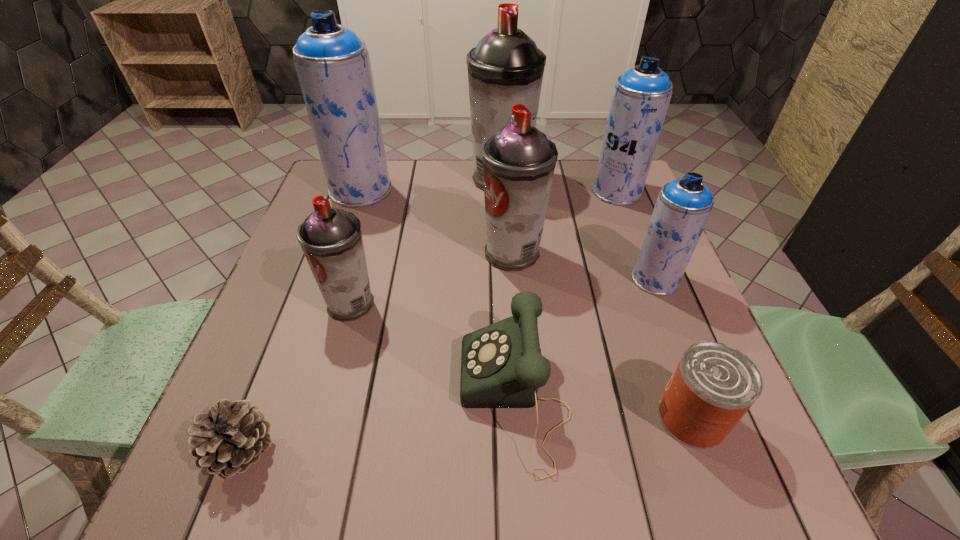
This screenshot has height=540, width=960. In order to click on the farthest gray aerosol can in this screenshot , I will do `click(506, 68)`.

Locate an element on the screen. The width and height of the screenshot is (960, 540). the biggest blue aerosol can is located at coordinates (333, 65).

This screenshot has height=540, width=960. Find the location of `the second smallest blue aerosol can`. the second smallest blue aerosol can is located at coordinates (641, 96).

Find the location of a particular element. The width and height of the screenshot is (960, 540). the second farthest gray aerosol can is located at coordinates (519, 161).

Identify the location of the leftmost gray aerosol can. (331, 239).

In order to click on the smallest gray aerosol can in this screenshot , I will do `click(331, 239)`.

I want to click on the smallest blue aerosol can, so click(x=683, y=206).

At what (x,y) coordinates should I click in order to perform the action: click on can. Please return your answer as a coordinate pair (x, y). This screenshot has height=540, width=960. Looking at the image, I should click on (713, 386).

The image size is (960, 540). In order to click on telephone in this screenshot , I will do `click(501, 364)`.

The width and height of the screenshot is (960, 540). I want to click on pinecone, so click(231, 437).